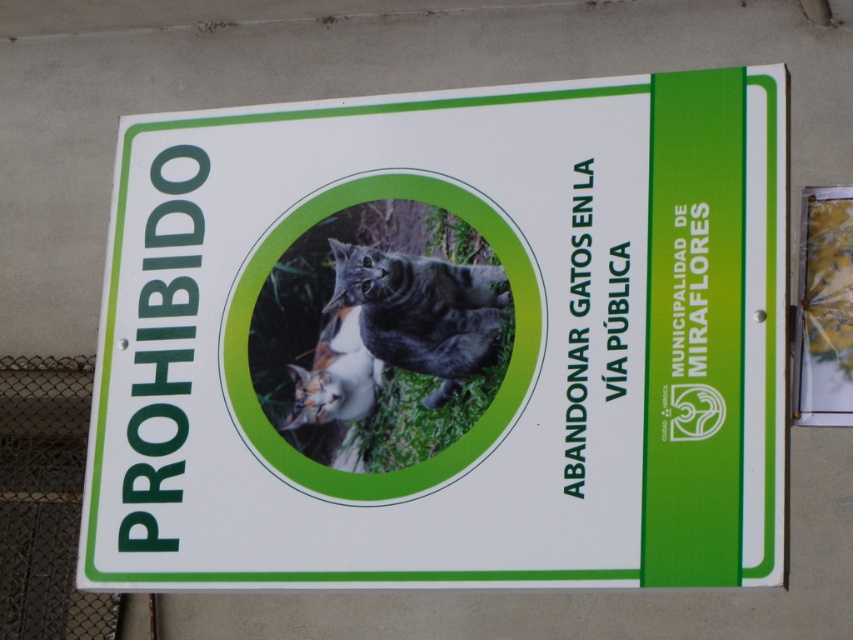
Question: Which point is farther to the camera?

Choices:
 (A) (393, 417)
 (B) (73, 515)
 (C) (293, 376)

Answer: (B)

Question: Can you confirm if green grass at center is positioned to the right of gray tabby cat at center?

Choices:
 (A) no
 (B) yes

Answer: (A)

Question: Is green plastic sign at center bigger than metal chain-link fence at lower left?

Choices:
 (A) no
 (B) yes

Answer: (B)

Question: Which is farther from the metal chain-link fence at lower left?

Choices:
 (A) green grass at center
 (B) calico fur cat at center
 (C) green plastic sign at center

Answer: (B)

Question: Does green plastic sign at center have a larger size compared to gray tabby cat at center?

Choices:
 (A) no
 (B) yes

Answer: (B)

Question: Which point appears farthest from the camera in this image?

Choices:
 (A) (370, 337)
 (B) (357, 125)
 (C) (364, 401)
 (D) (54, 532)

Answer: (D)